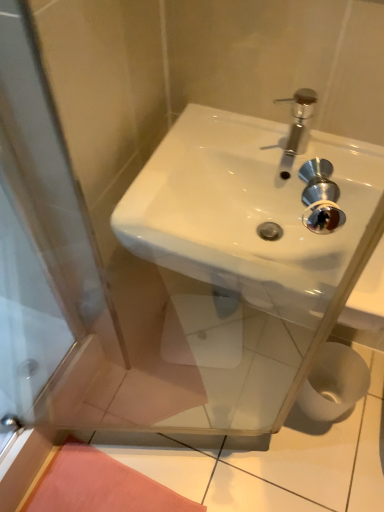
Question: In terms of height, does white glossy sink at center look taller or shorter compared to white matte toilet paper at lower right?

Choices:
 (A) short
 (B) tall

Answer: (A)

Question: Is white glossy sink at center inside or outside of white matte toilet paper at lower right?

Choices:
 (A) inside
 (B) outside

Answer: (B)

Question: Looking at their shapes, would you say white glossy sink at center is wider or thinner than white matte toilet paper at lower right?

Choices:
 (A) wide
 (B) thin

Answer: (A)

Question: Based on their positions, is white matte toilet paper at lower right located to the left or right of white glossy sink at center?

Choices:
 (A) left
 (B) right

Answer: (B)

Question: Based on their sizes in the image, would you say white matte toilet paper at lower right is bigger or smaller than white glossy sink at center?

Choices:
 (A) small
 (B) big

Answer: (A)

Question: Do you think white matte toilet paper at lower right is within white glossy sink at center, or outside of it?

Choices:
 (A) outside
 (B) inside

Answer: (A)

Question: In terms of height, does white matte toilet paper at lower right look taller or shorter compared to white glossy sink at center?

Choices:
 (A) tall
 (B) short

Answer: (A)